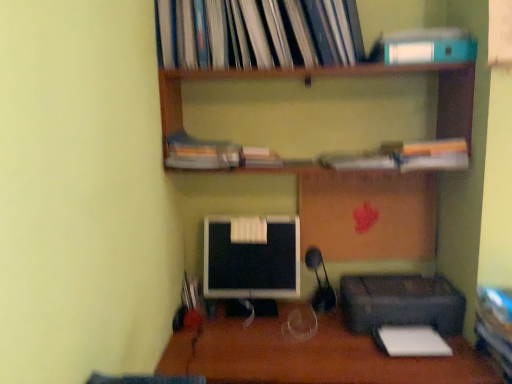
Question: From the image's perspective, does black glossy monitor at center appear lower than teal matte paperback book at upper right?

Choices:
 (A) yes
 (B) no

Answer: (A)

Question: Considering the relative sizes of black glossy monitor at center and teal matte paperback book at upper right in the image provided, is black glossy monitor at center wider than teal matte paperback book at upper right?

Choices:
 (A) yes
 (B) no

Answer: (B)

Question: Does black glossy monitor at center turn towards teal matte paperback book at upper right?

Choices:
 (A) yes
 (B) no

Answer: (B)

Question: Can you confirm if black glossy monitor at center is bigger than teal matte paperback book at upper right?

Choices:
 (A) yes
 (B) no

Answer: (A)

Question: From a real-world perspective, does black glossy monitor at center stand above teal matte paperback book at upper right?

Choices:
 (A) no
 (B) yes

Answer: (A)

Question: Would you say matte plastic book at center, the third book from the top, is to the left or to the right of black plastic printer at lower right in the picture?

Choices:
 (A) right
 (B) left

Answer: (B)

Question: Is matte plastic book at center, the third book from the top, wider or thinner than black plastic printer at lower right?

Choices:
 (A) wide
 (B) thin

Answer: (B)

Question: From the image's perspective, is matte plastic book at center, which ranks as the second book in bottom-to-top order, above or below black plastic printer at lower right?

Choices:
 (A) below
 (B) above

Answer: (B)

Question: Is matte plastic book at center, the third book from the top, inside the boundaries of black plastic printer at lower right, or outside?

Choices:
 (A) inside
 (B) outside

Answer: (B)

Question: Considering the positions of matte plastic book at center, which ranks as the second book in bottom-to-top order, and wooden shelves at upper center in the image, is matte plastic book at center, which ranks as the second book in bottom-to-top order, wider or thinner than wooden shelves at upper center?

Choices:
 (A) thin
 (B) wide

Answer: (A)

Question: Is matte plastic book at center, the third book from the top, bigger or smaller than wooden shelves at upper center?

Choices:
 (A) big
 (B) small

Answer: (B)

Question: Considering their positions, is matte plastic book at center, which ranks as the second book in bottom-to-top order, located in front of or behind wooden shelves at upper center?

Choices:
 (A) behind
 (B) front

Answer: (A)

Question: Visually, is matte plastic book at center, which ranks as the second book in bottom-to-top order, positioned to the left or to the right of wooden shelves at upper center?

Choices:
 (A) left
 (B) right

Answer: (A)

Question: From a real-world perspective, is black glossy monitor at center above or below wooden desk at center?

Choices:
 (A) above
 (B) below

Answer: (A)

Question: In terms of height, does black glossy monitor at center look taller or shorter compared to wooden desk at center?

Choices:
 (A) short
 (B) tall

Answer: (A)